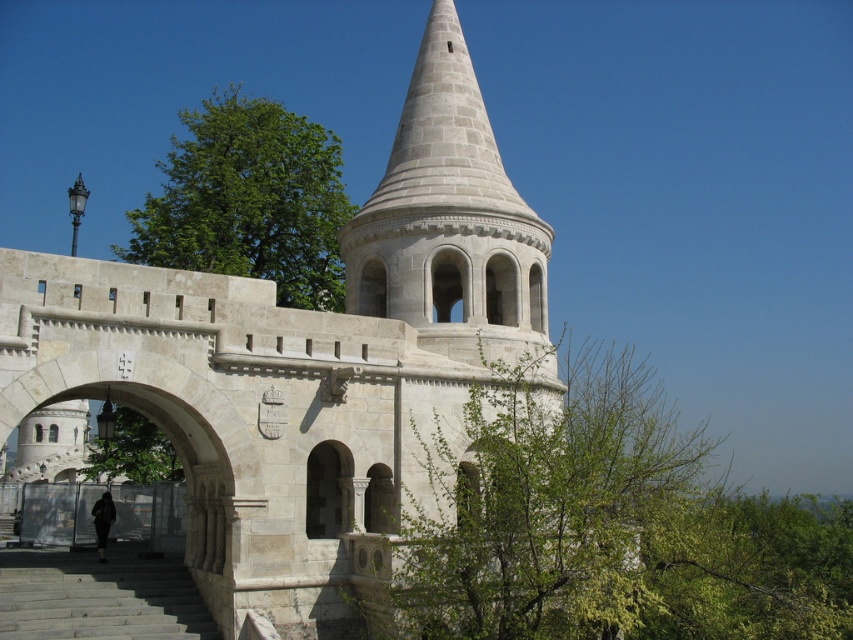
Question: Which of the following is the closest to the observer?

Choices:
 (A) gray stone bell tower at center
 (B) green leafy tree at center

Answer: (B)

Question: Which object is the farthest from the white stone tower at center?

Choices:
 (A) green leafy tree at lower left
 (B) green leafy tree at upper left

Answer: (B)

Question: Which of the following is the farthest from the observer?

Choices:
 (A) (160, 365)
 (B) (389, 192)
 (C) (276, 198)

Answer: (C)

Question: Is gray stone bell tower at center positioned at the back of green leafy tree at lower left?

Choices:
 (A) no
 (B) yes

Answer: (B)

Question: Does white stone tower at center appear on the left side of gray stone stairs at lower left?

Choices:
 (A) no
 (B) yes

Answer: (B)

Question: Does green leafy tree at center have a larger size compared to gray stone stairs at lower left?

Choices:
 (A) yes
 (B) no

Answer: (A)